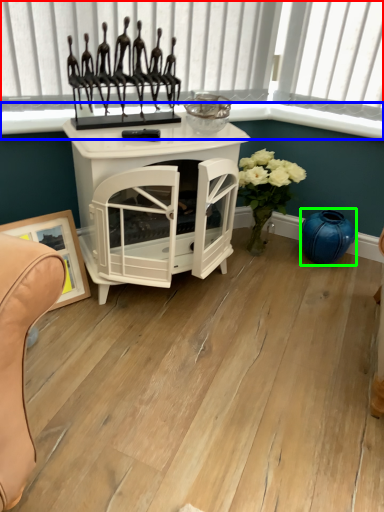
Question: Which object is positioned farthest from window frame (highlighted by a red box)? Select from window sill (highlighted by a blue box) and vase (highlighted by a green box).

Choices:
 (A) window sill
 (B) vase

Answer: (B)